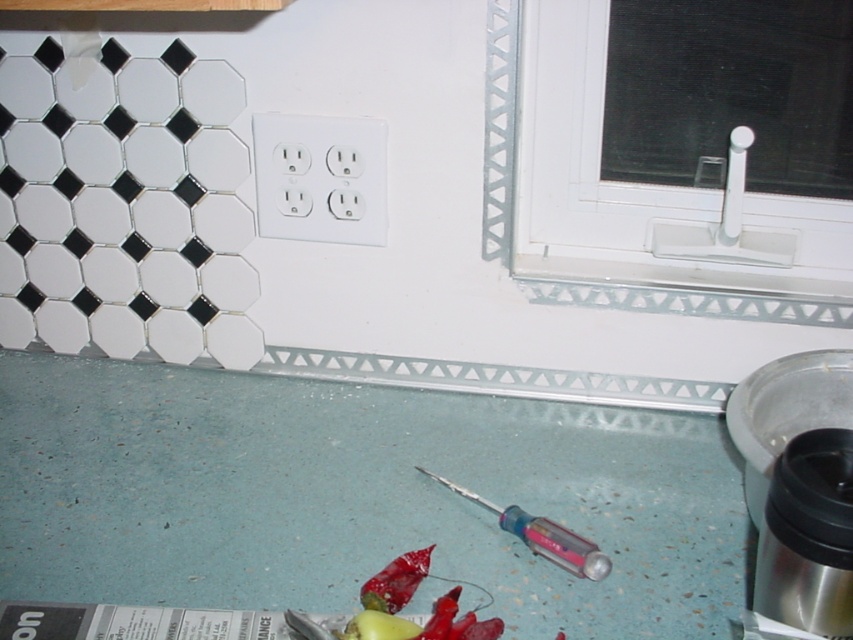
You are a kitchen designer planning to install a new backsplash. You need to place a decorative tile at the point marked by the coordinates point (x=657, y=180). According to the scene description, what object is located at this point?

The point (x=657, y=180) marks the white plastic window sill at right, so the decorative tile should be placed there.